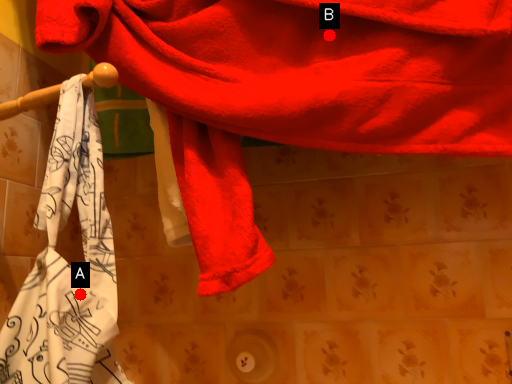
Question: Two points are circled on the image, labeled by A and B beside each circle. Which point is farther to the camera?

Choices:
 (A) A is further
 (B) B is further

Answer: (B)